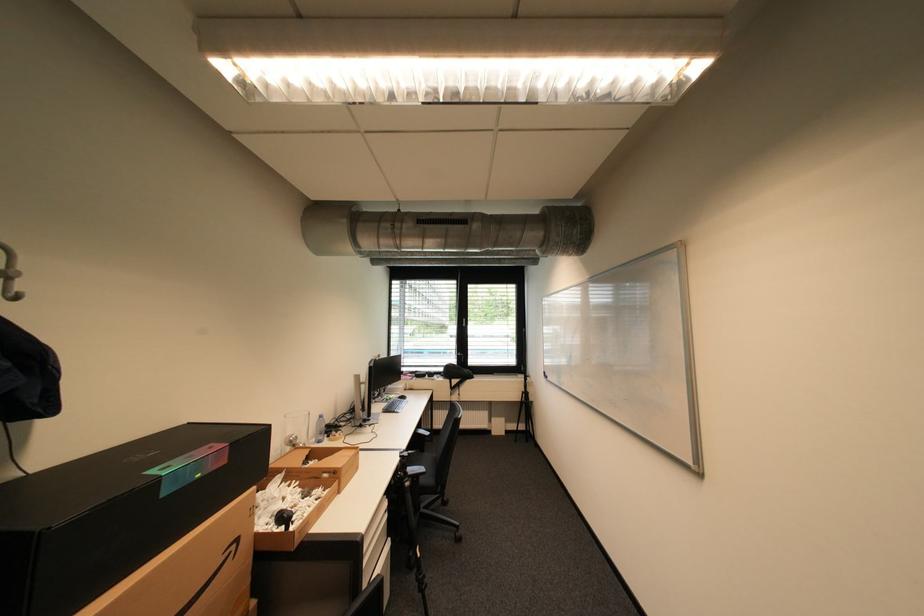
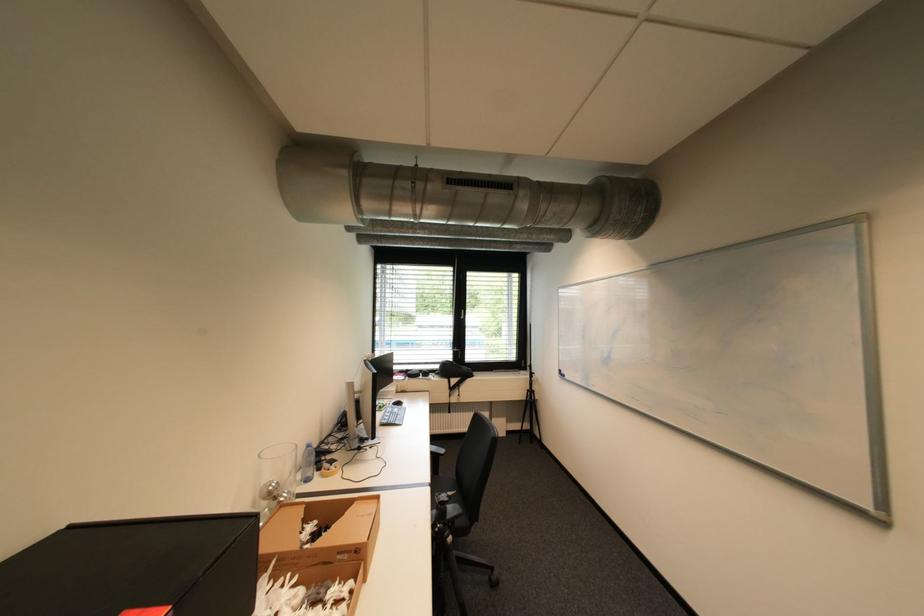
Locate, in the second image, the point that corresponds to (x=472, y=320) in the first image.

(470, 312)